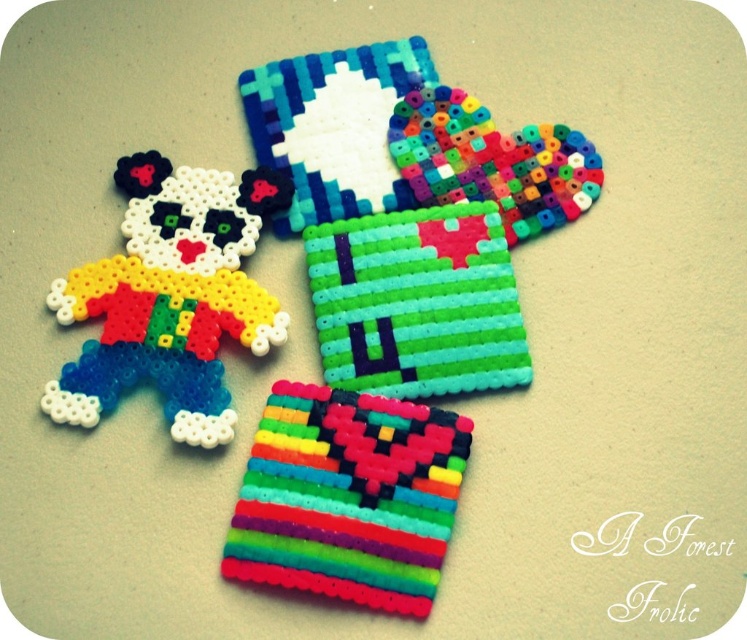
Who is taller, rainbow plastic beads at center or multicolored beads at center?

Standing taller between the two is rainbow plastic beads at center.

Measure the distance between rainbow plastic beads at center and camera.

rainbow plastic beads at center and camera are 1.25 meters apart.

Where is `rainbow plastic beads at center`? rainbow plastic beads at center is located at coordinates (347, 497).

Can you confirm if rainbow plastic beads at center is thinner than matte plastic clown at left?

Yes.

Who is more forward, (359, 403) or (205, 305)?

Positioned in front is point (359, 403).

Where is `rainbow plastic beads at center`? rainbow plastic beads at center is located at coordinates (347, 497).

Who is positioned more to the right, rainbow plastic beads at center or green matte pixelated square at center?

green matte pixelated square at center

Where is `rainbow plastic beads at center`? This screenshot has width=747, height=640. rainbow plastic beads at center is located at coordinates (347, 497).

In order to click on rainbow plastic beads at center in this screenshot , I will do `click(347, 497)`.

You are a GUI agent. You are given a task and a screenshot of the screen. Output one action in this format:
    pyautogui.click(x=<x>, y=<y>)
    Task: Click on the rainbow plastic beads at center
    The image size is (747, 640).
    Given the screenshot: What is the action you would take?
    pyautogui.click(x=347, y=497)